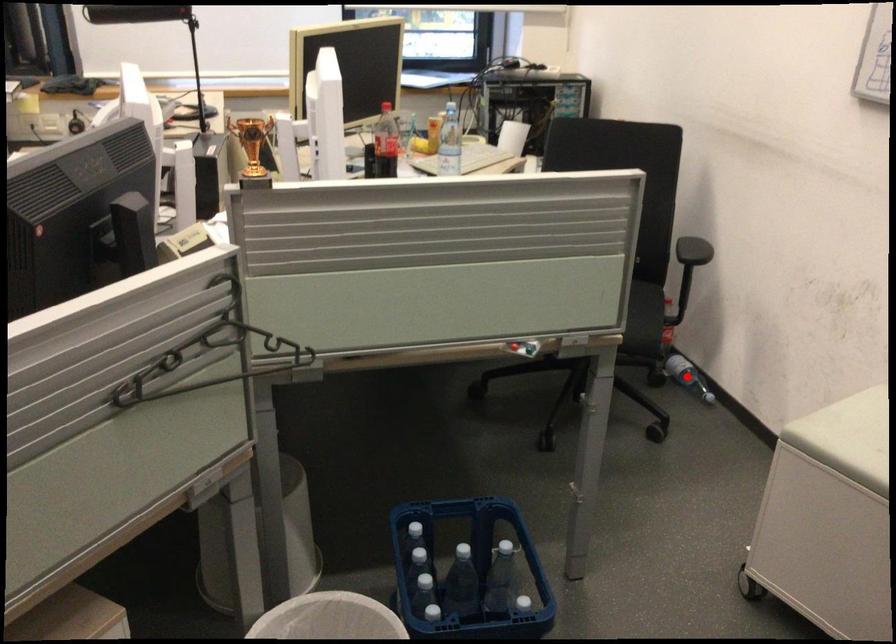
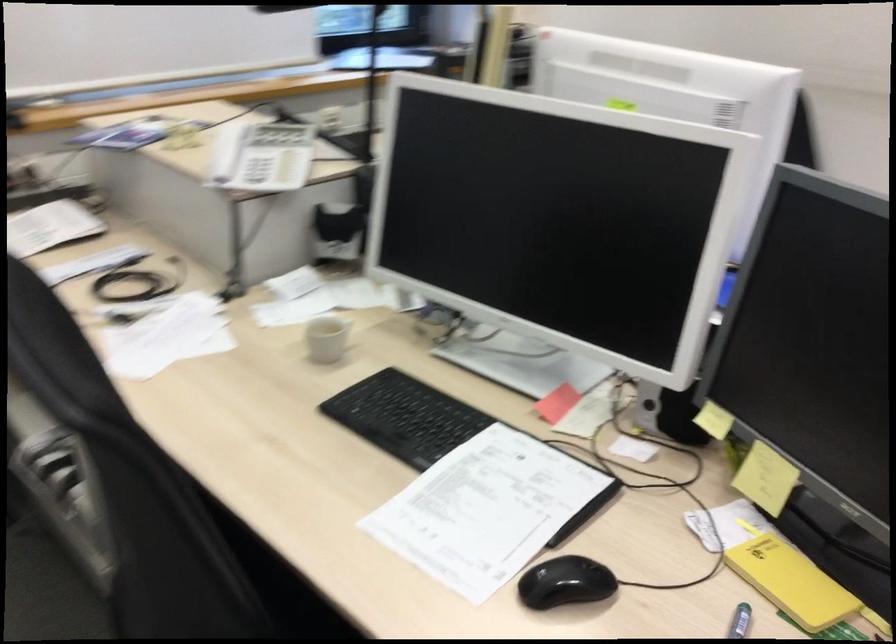
Question: I am providing you with two images of the same scene from different viewpoints. A red point is marked on the first image. Is the red point's position out of view in image 2?

Choices:
 (A) Yes
 (B) No

Answer: (A)